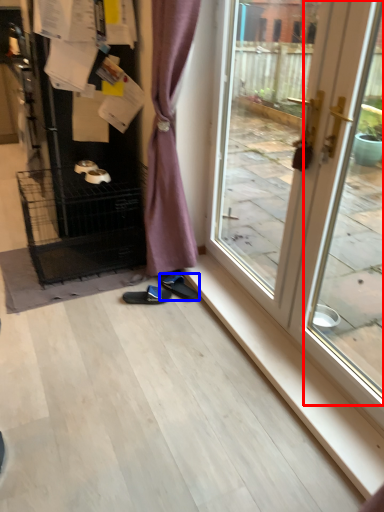
Question: Which point is closer to the camera, screen door (highlighted by a red box) or footwear (highlighted by a blue box)?

Choices:
 (A) screen door
 (B) footwear

Answer: (A)